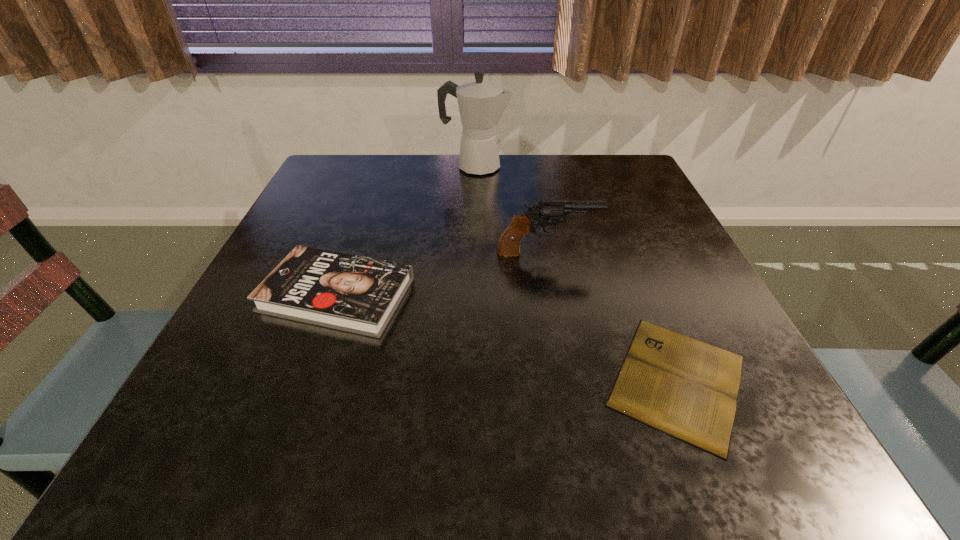
The image size is (960, 540). Find the location of `free space between the left book and the gun`. free space between the left book and the gun is located at coordinates (442, 274).

Locate an element on the screen. free spot between the second farthest object and the shorter book is located at coordinates (612, 316).

At what (x,y) coordinates should I click in order to perform the action: click on unoccupied area between the third tallest object and the third nearest object. Please return your answer as a coordinate pair (x, y). This screenshot has height=540, width=960. Looking at the image, I should click on (442, 274).

Identify the location of the third closest object to the taller book. This screenshot has height=540, width=960. (481, 104).

Choose which object is the third nearest neighbor to the shortest object. Please provide its 2D coordinates. Your answer should be formatted as a tuple, i.e. [(x, y)], where the tuple contains the x and y coordinates of a point satisfying the conditions above.

[(481, 104)]

Find the location of a particular element. vacant position in the image that satisfies the following two spatial constraints: 1. along the barrel of the shorter book; 2. on the right side of the gun is located at coordinates click(571, 380).

This screenshot has width=960, height=540. I want to click on vacant space that satisfies the following two spatial constraints: 1. on the front side of the left book; 2. on the left side of the shortest object, so click(306, 380).

Where is `free spot that satisfies the following two spatial constraints: 1. on the front side of the right book; 2. on the left side of the farthest object`? free spot that satisfies the following two spatial constraints: 1. on the front side of the right book; 2. on the left side of the farthest object is located at coordinates (471, 380).

Find the location of a particular element. vacant space that satisfies the following two spatial constraints: 1. on the back side of the taller book; 2. on the left side of the tallest object is located at coordinates pyautogui.click(x=382, y=166).

You are a GUI agent. You are given a task and a screenshot of the screen. Output one action in this format:
    pyautogui.click(x=<x>, y=<y>)
    Task: Click on the free space that satisfies the following two spatial constraints: 1. along the barrel of the third nearest object; 2. on the left side of the shorter book
    The height and width of the screenshot is (540, 960).
    Given the screenshot: What is the action you would take?
    pyautogui.click(x=571, y=380)